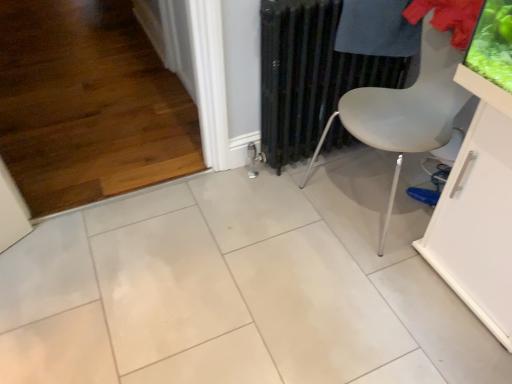
This screenshot has width=512, height=384. I want to click on vacant area that is in front of white matte chair at center-right, so click(x=377, y=289).